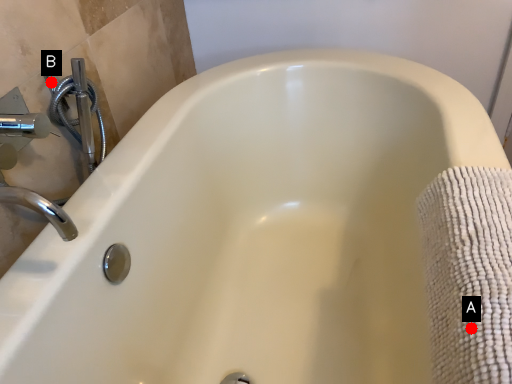
Question: Two points are circled on the image, labeled by A and B beside each circle. Among these points, which one is farthest from the camera?

Choices:
 (A) A is further
 (B) B is further

Answer: (B)